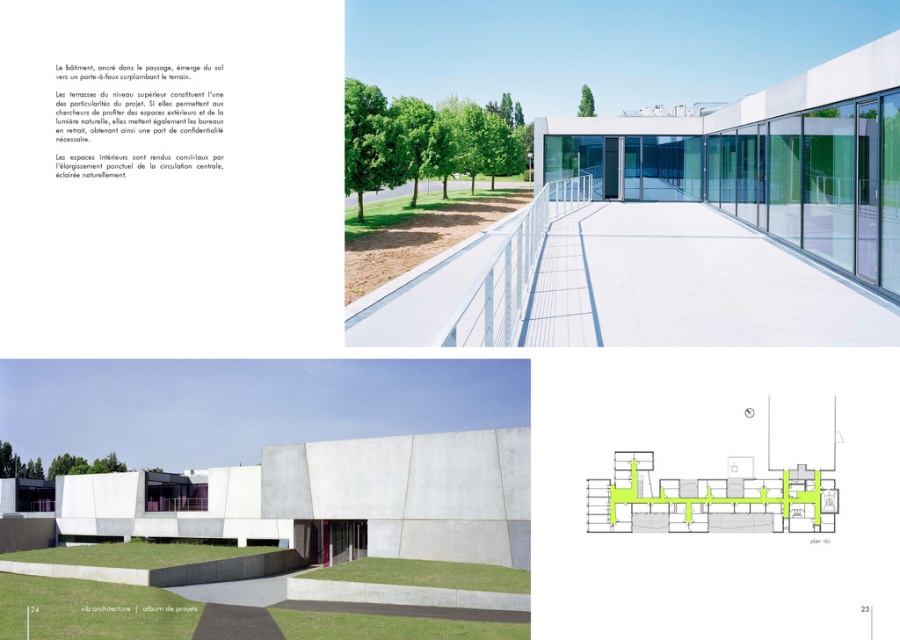
You are an architect reviewing the top section of the image. You need to determine the spatial relationship between the white concrete building at center and the green concrete staircase at center. Which object is located to the left of the other?

The white concrete building at center is positioned on the left side of green concrete staircase at center, so the white concrete building at center is to the left of the green concrete staircase at center.

You are standing on the walkway next to the white glass building at center and want to reach the green concrete staircase at center. Which direction should you move to get there?

The white glass building at center is located above the green concrete staircase at center, so you should move downward to reach the green concrete staircase at center.

You are an architect reviewing the design of the modern structure. The top section shows the exterior view, and the bottom section shows the interior. In the top section, you notice two buildings labeled as the white glass building at center and the white concrete building at center. Which one is situated higher in elevation?

The white glass building at center is positioned over the white concrete building at center, so it is situated higher in elevation.